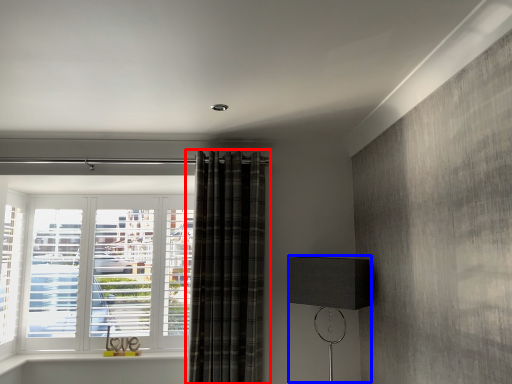
Question: Which object appears closest to the camera in this image, curtain (highlighted by a red box) or table lamp (highlighted by a blue box)?

Choices:
 (A) curtain
 (B) table lamp

Answer: (B)